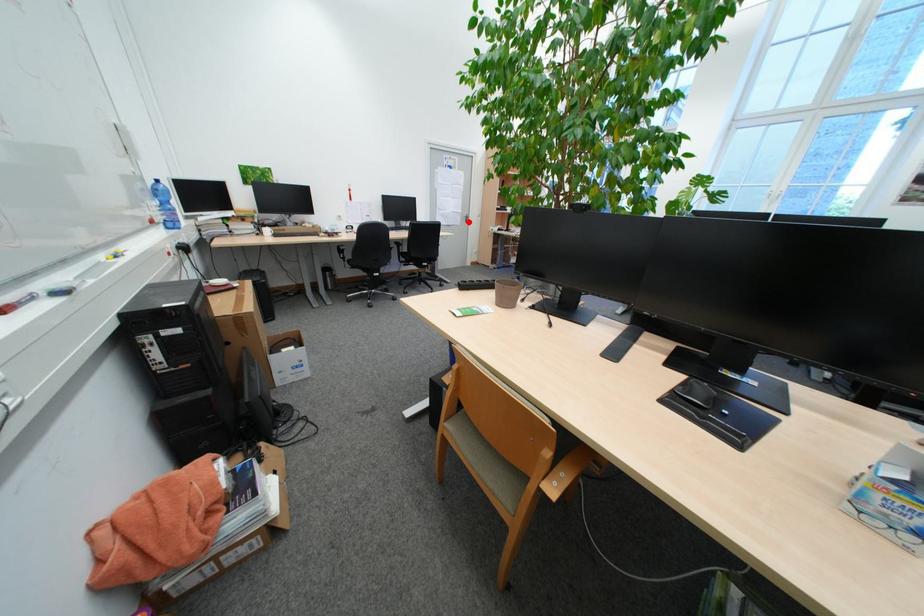
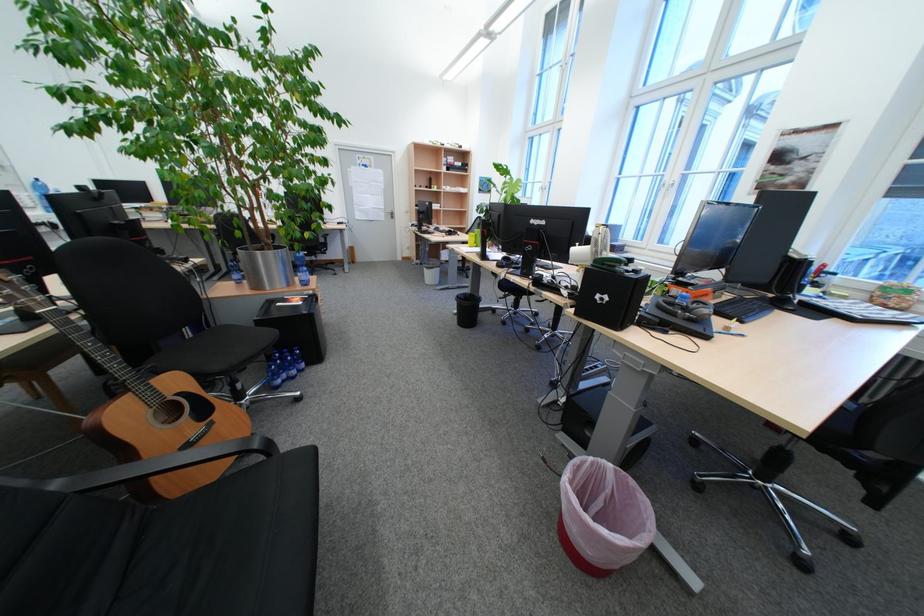
The point at the highlighted location is marked in the first image. Where is the corresponding point in the second image?

(394, 217)